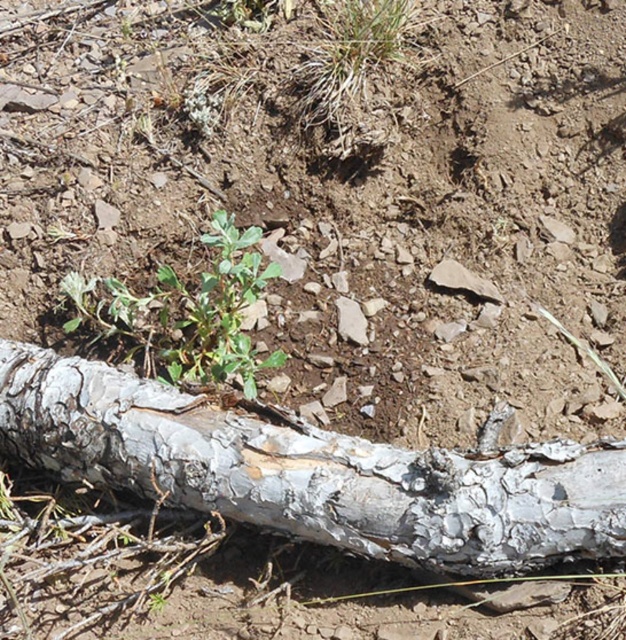
Question: Can you confirm if gray rough bark log at center is positioned to the left of green leafy plant at center?

Choices:
 (A) yes
 (B) no

Answer: (B)

Question: In this image, where is gray rough bark log at center located relative to green leafy plant at center?

Choices:
 (A) above
 (B) below

Answer: (B)

Question: Does gray rough bark log at center have a greater width compared to green leafy plant at center?

Choices:
 (A) yes
 (B) no

Answer: (A)